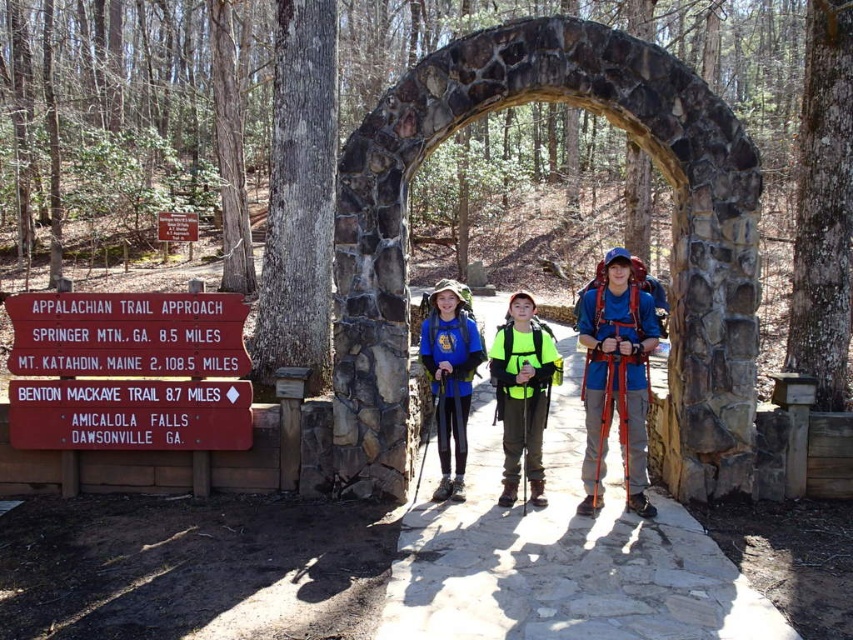
? Alright, let me tackle this step by step. First, I need to understand the given information. The scene is a forested area with an archway, three people, a red sign on the left, and a blue jacket at the center. The objects are the red wooden sign at left and the blue fleece jacket at center. The object description says the red sign is above the blue jacket. The task is to create a question and answer based on these without revealing the

? Wait, the user provided an example where the question and answer are generated. Let me check the rules again. The question must mention both objects exactly as given, use the scene context, and not reveal the description details. The answer should use the object description. So the objects are